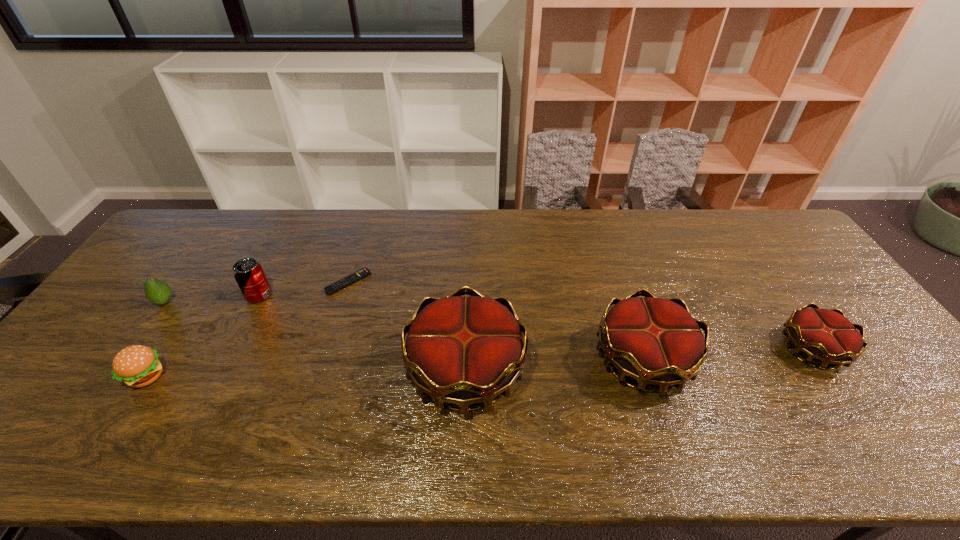
Identify which crown is located as the nearest to the leftmost object. Please provide its 2D coordinates. Your answer should be formatted as a tuple, i.e. [(x, y)], where the tuple contains the x and y coordinates of a point satisfying the conditions above.

[(463, 350)]

You are a GUI agent. You are given a task and a screenshot of the screen. Output one action in this format:
    pyautogui.click(x=<x>, y=<y>)
    Task: Click on the crown that is the second closest to the avocado
    
    Given the screenshot: What is the action you would take?
    pyautogui.click(x=656, y=341)

You are a GUI agent. You are given a task and a screenshot of the screen. Output one action in this format:
    pyautogui.click(x=<x>, y=<y>)
    Task: Click on the vacant region that satisfies the following two spatial constraints: 1. on the front side of the fifth object from left to right; 2. on the left side of the soda can
    
    Given the screenshot: What is the action you would take?
    pyautogui.click(x=221, y=370)

Where is `free location that satisfies the following two spatial constraints: 1. on the back side of the shortest crown; 2. on the right side of the second object from left to right`? free location that satisfies the following two spatial constraints: 1. on the back side of the shortest crown; 2. on the right side of the second object from left to right is located at coordinates (164, 349).